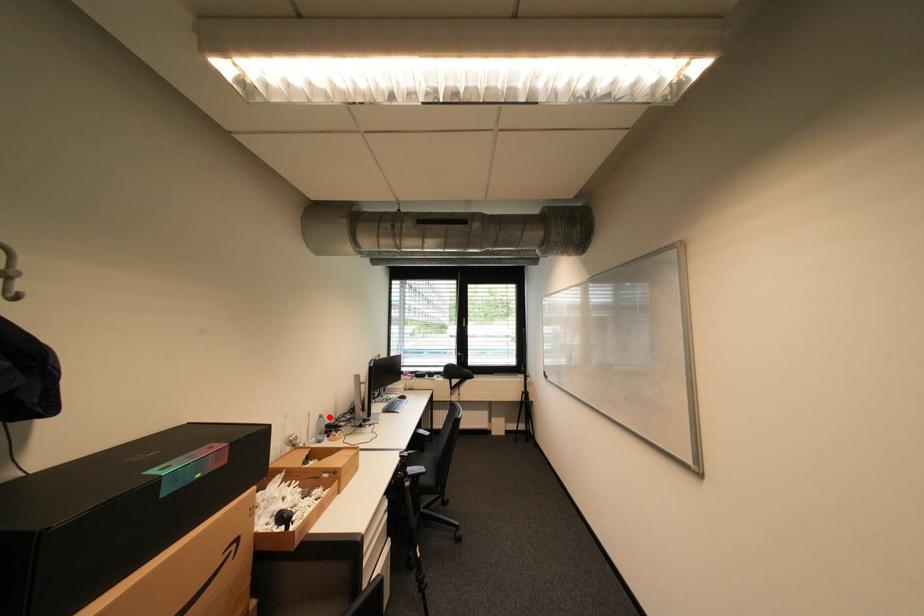
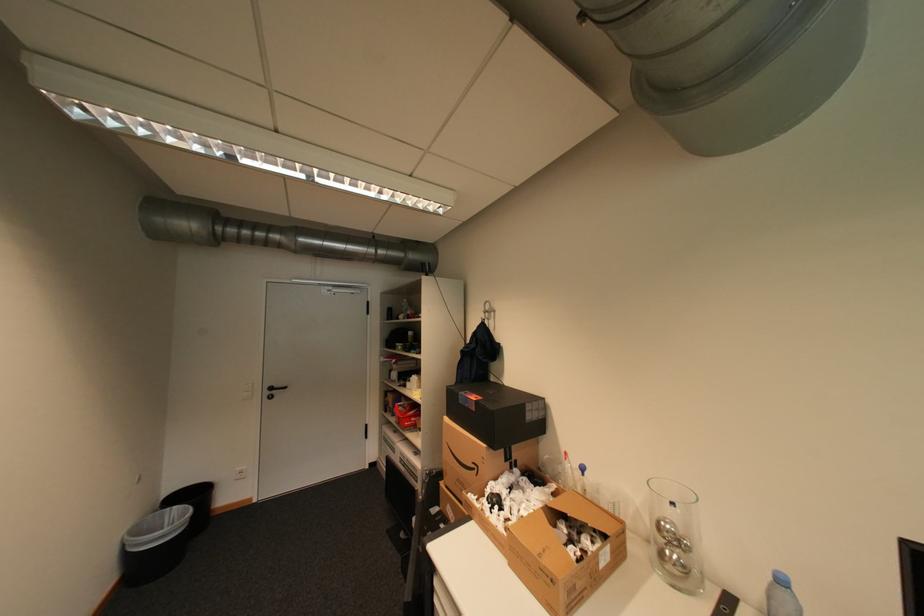
Find the pixel in the second image that matches the highlighted location in the first image.

(791, 582)